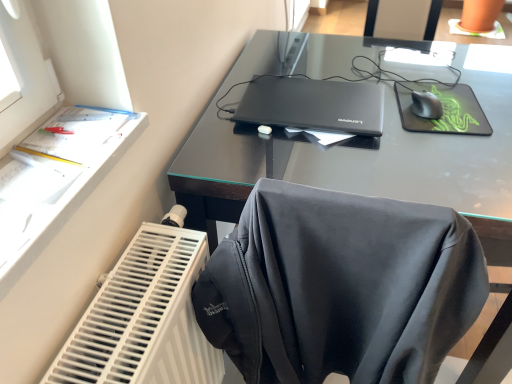
The width and height of the screenshot is (512, 384). Find the location of `free point to the right of black matte laptop at center`. free point to the right of black matte laptop at center is located at coordinates (412, 118).